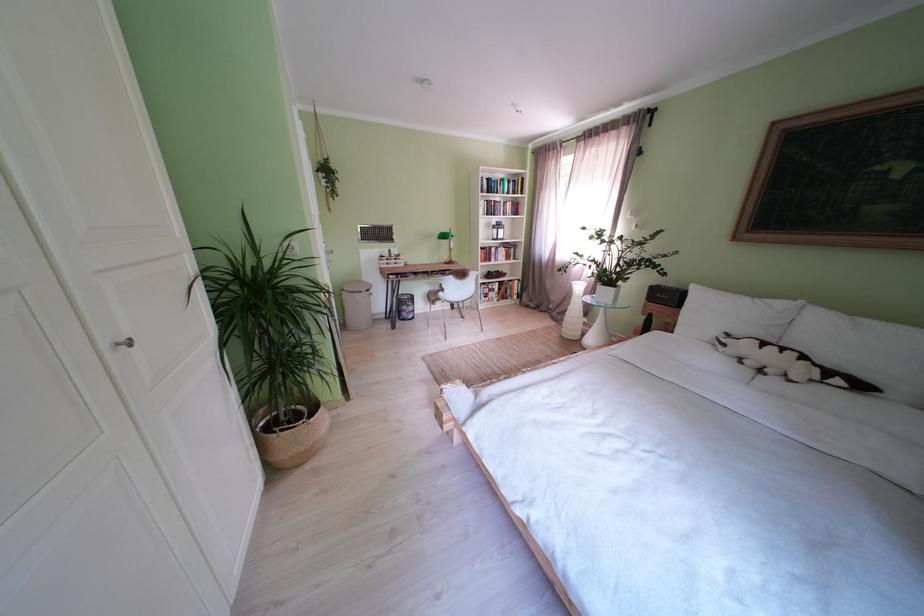
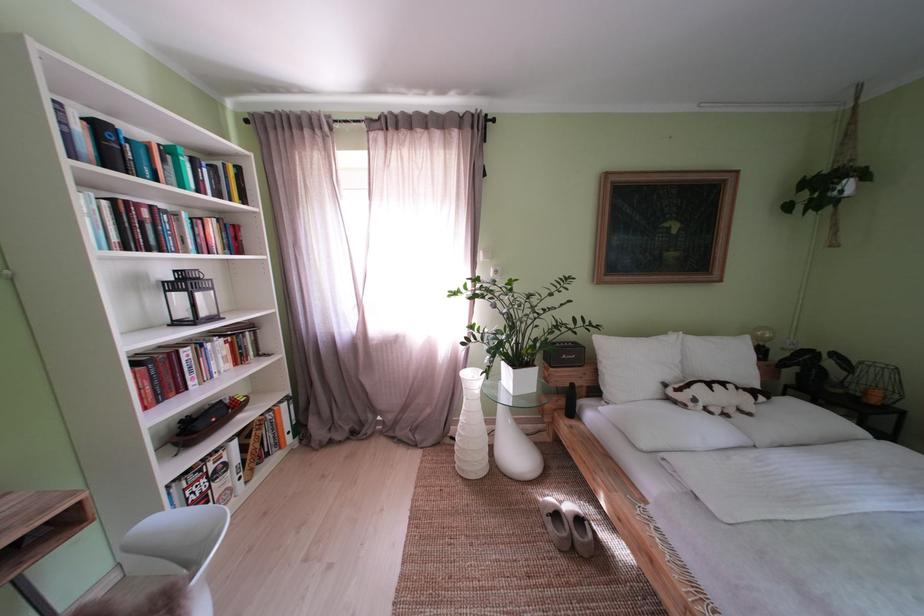
The point at (x=879, y=326) is marked in the first image. Where is the corresponding point in the second image?

(723, 344)